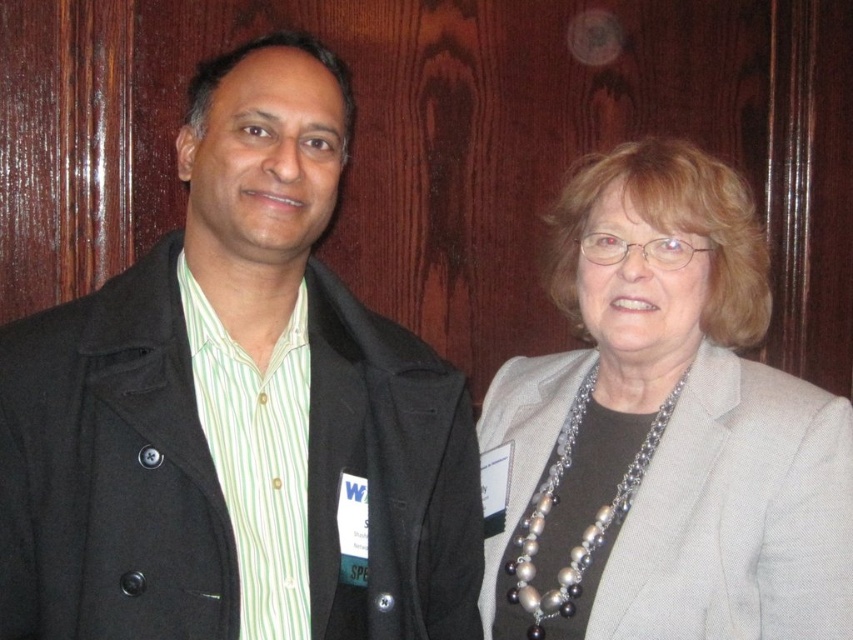
Who is lower down, gray fabric jacket at upper right or pearl and silver chain at center?

pearl and silver chain at center is below.

Does gray fabric jacket at upper right come behind pearl and silver chain at center?

No, it is not.

Is point (675, 637) closer to viewer compared to point (537, 611)?

Yes.

Find the location of `gray fabric jacket at upper right`. gray fabric jacket at upper right is located at coordinates (665, 429).

Between point (277, 230) and point (701, 349), which one is positioned behind?

The point (701, 349) is behind.

Can you confirm if black wool coat at left is positioned above gray fabric jacket at upper right?

Yes.

Where is `black wool coat at left`? The image size is (853, 640). black wool coat at left is located at coordinates (236, 410).

Is black wool coat at left shorter than pearl and silver chain at center?

No, black wool coat at left is not shorter than pearl and silver chain at center.

Does black wool coat at left appear on the right side of pearl and silver chain at center?

In fact, black wool coat at left is to the left of pearl and silver chain at center.

Where is `black wool coat at left`? black wool coat at left is located at coordinates (236, 410).